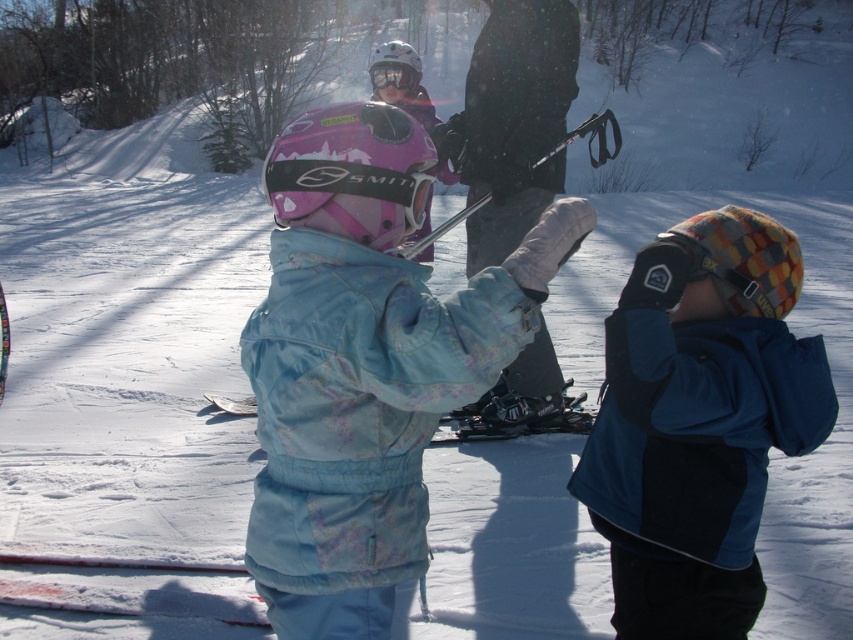
Question: Which of the following is the farthest from the observer?

Choices:
 (A) (183, 595)
 (B) (357, 259)
 (C) (776, 301)
 (D) (445, 220)

Answer: (D)

Question: Does pink matte helmet at center appear on the right side of matte blue ski at center?

Choices:
 (A) no
 (B) yes

Answer: (A)

Question: Considering the relative positions of matte blue ski at center and matte pink helmet at upper center in the image provided, where is matte blue ski at center located with respect to matte pink helmet at upper center?

Choices:
 (A) right
 (B) left

Answer: (A)

Question: Among these points, which one is farthest from the camera?

Choices:
 (A) (485, 420)
 (B) (421, 170)

Answer: (A)

Question: Which object is the closest to the red plastic ski at lower left?

Choices:
 (A) pink matte helmet at center
 (B) black rubber ski pole at center

Answer: (A)

Question: Is matte black ski pole at center to the left of red plastic ski at lower left from the viewer's perspective?

Choices:
 (A) yes
 (B) no

Answer: (B)